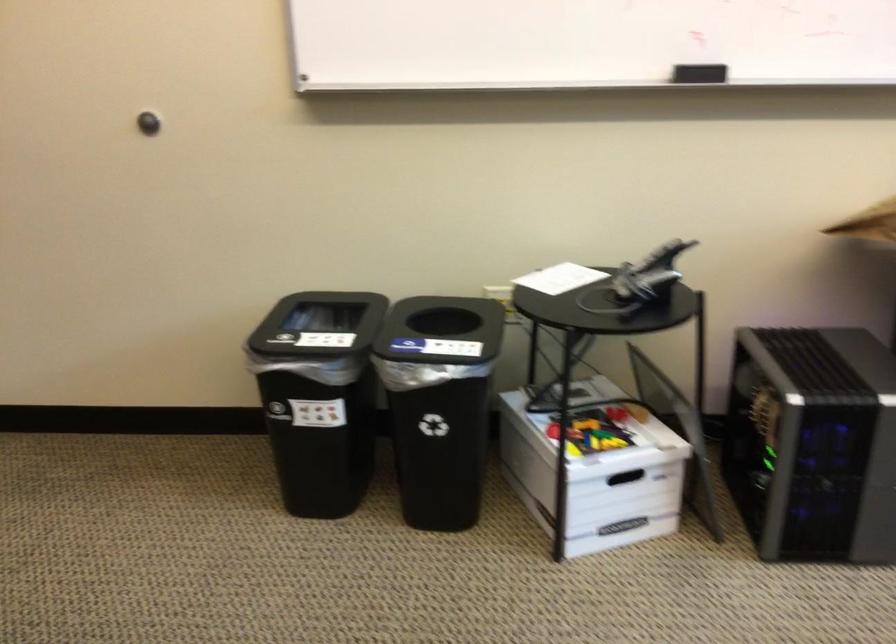
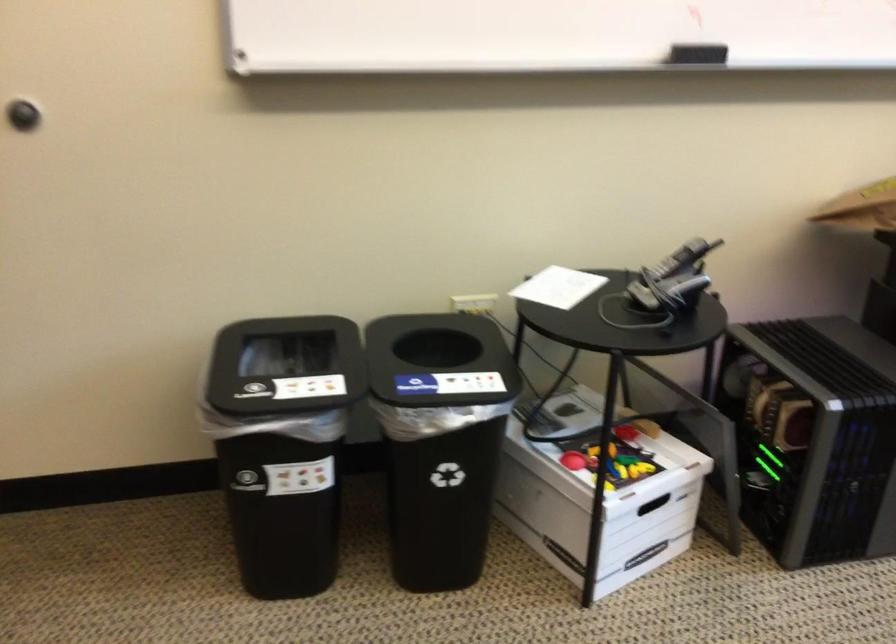
The images are taken continuously from a first-person perspective. In which direction are you moving?

The cameraman moved toward left, forward.